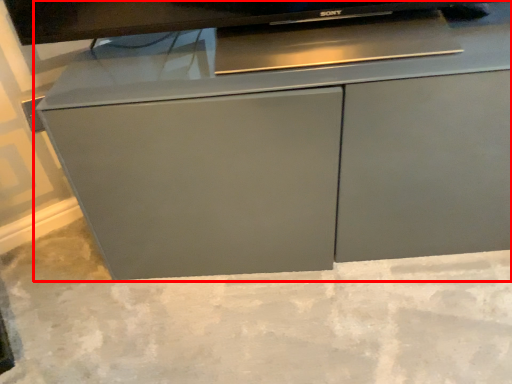
Question: From the image, what is the correct spatial relationship of cabinetry (annotated by the red box) in relation to concrete?

Choices:
 (A) left
 (B) right

Answer: (B)